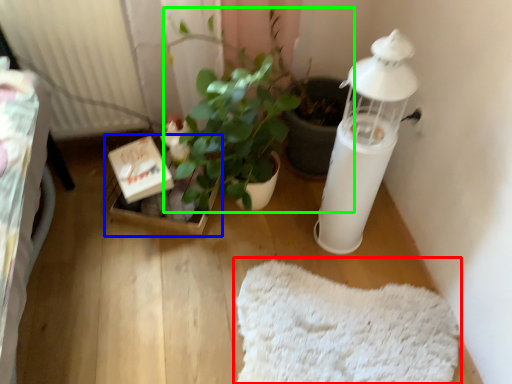
Question: Estimate the real-world distances between objects in this image. Which object is farther from mat (highlighted by a red box), cardboard box (highlighted by a blue box) or houseplant (highlighted by a green box)?

Choices:
 (A) cardboard box
 (B) houseplant

Answer: (A)